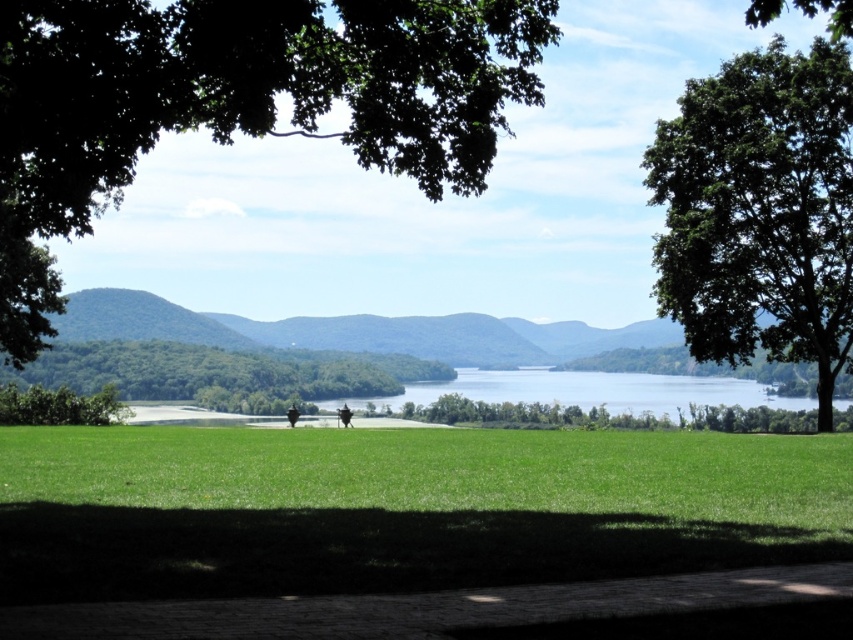
You are standing at the center of the green grass in the foreground of the image. You want to walk towards the dense cluster of trees in the distance. There is a point marked at coordinates (759, 211) on your path. What object is located at this point?

The point at coordinates (759, 211) corresponds to a green leafy tree at upper right.